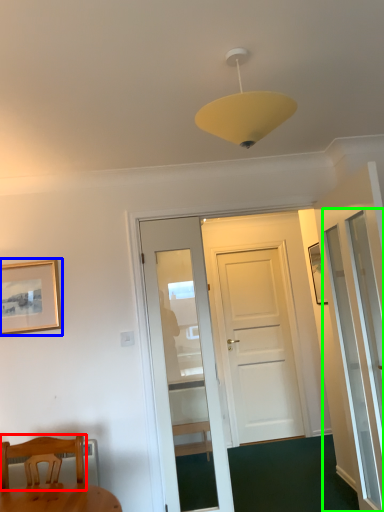
Question: Which is nearer to the chair (highlighted by a red box)? picture frame (highlighted by a blue box) or screen door (highlighted by a green box).

Choices:
 (A) picture frame
 (B) screen door

Answer: (A)